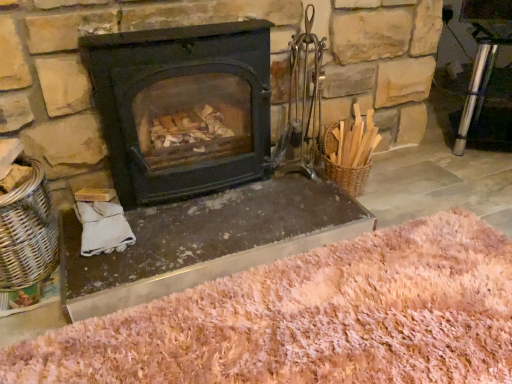
Question: Which is correct: pink shaggy rug at lower center is inside woven wicker basket at left, or outside of it?

Choices:
 (A) inside
 (B) outside

Answer: (B)

Question: Is pink shaggy rug at lower center to the left or to the right of woven wicker basket at left in the image?

Choices:
 (A) left
 (B) right

Answer: (B)

Question: Based on their relative distances, which object is farther from the metallic gray fireplace at center?

Choices:
 (A) matte black wood burning stove at center
 (B) pink shaggy rug at lower center
 (C) woven wicker basket at left

Answer: (C)

Question: Estimate the real-world distances between objects in this image. Which object is farther from the woven wicker basket at left?

Choices:
 (A) matte black wood burning stove at center
 (B) pink shaggy rug at lower center
 (C) metallic gray fireplace at center

Answer: (B)